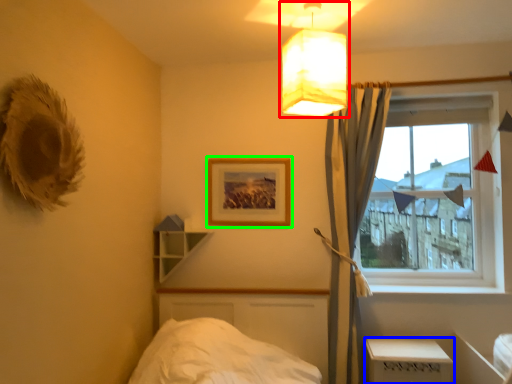
Question: Which is farther away from lamp (highlighted by a red box)? table (highlighted by a blue box) or picture frame (highlighted by a green box)?

Choices:
 (A) table
 (B) picture frame

Answer: (A)